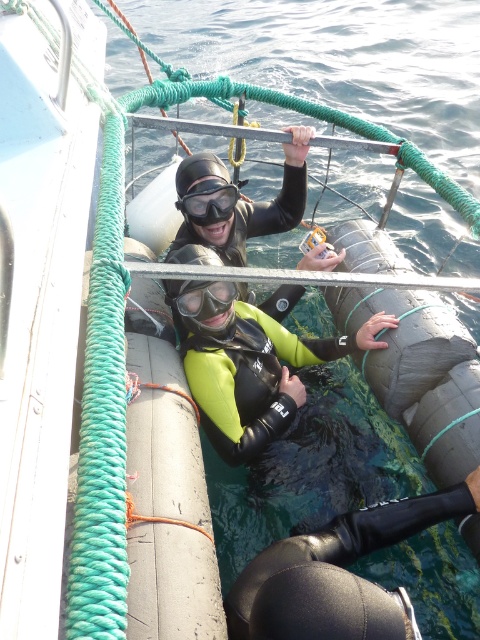
Which is more to the left, neon green neoprene wetsuit at center or black matte goggles at center?

From the viewer's perspective, black matte goggles at center appears more on the left side.

Is point (257, 340) closer to viewer compared to point (203, 220)?

That is True.

Locate an element on the screen. This screenshot has width=480, height=640. neon green neoprene wetsuit at center is located at coordinates (248, 364).

Can you confirm if neon green neoprene wetsuit at center is thinner than matte black goggles at center?

In fact, neon green neoprene wetsuit at center might be wider than matte black goggles at center.

Is point (284, 355) positioned behind point (188, 292)?

Yes, it is behind point (188, 292).

Locate an element on the screen. This screenshot has width=480, height=640. neon green neoprene wetsuit at center is located at coordinates (248, 364).

Does black matte goggles at center have a greater width compared to matte black goggles at center?

Yes.

Measure the distance between black matte goggles at center and camera.

black matte goggles at center is 3.50 meters from camera.

Does point (217, 177) come farther from viewer compared to point (217, 296)?

Yes, point (217, 177) is behind point (217, 296).

The height and width of the screenshot is (640, 480). Identify the location of black matte goggles at center. (208, 202).